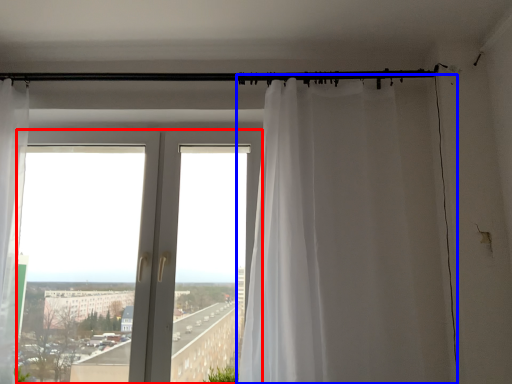
Question: Among these objects, which one is farthest to the camera, window (highlighted by a red box) or curtain (highlighted by a blue box)?

Choices:
 (A) window
 (B) curtain

Answer: (A)